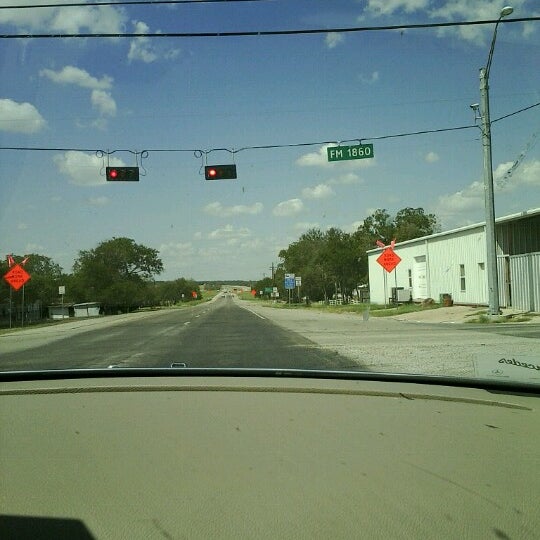
Find the location of a particular element. The width and height of the screenshot is (540, 540). window is located at coordinates (464, 286), (408, 280).